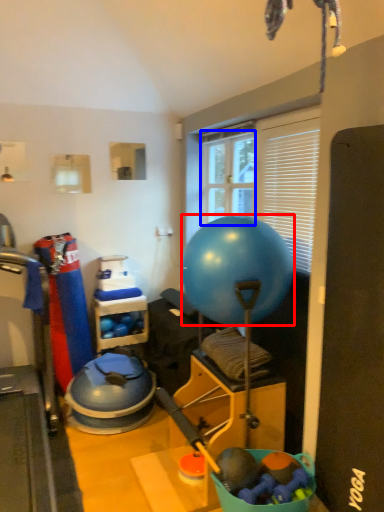
Question: Among these objects, which one is farthest to the camera, ball (highlighted by a red box) or window screen (highlighted by a blue box)?

Choices:
 (A) ball
 (B) window screen

Answer: (B)